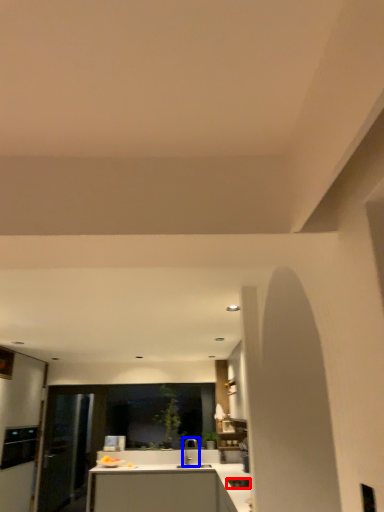
Question: Which point is closer to the camera, appliance (highlighted by a red box) or tap (highlighted by a blue box)?

Choices:
 (A) appliance
 (B) tap

Answer: (A)